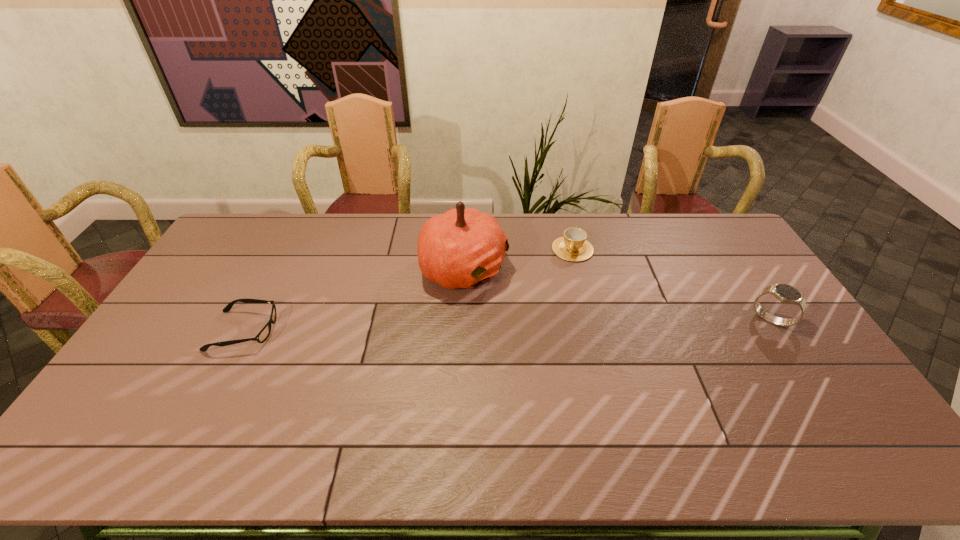
This screenshot has width=960, height=540. I want to click on vacant space on the desktop that is between the leftmost object and the rightmost object and is positioned on the front-facing side of the pumpkin, so click(583, 323).

Identify the location of free space on the desktop that is between the leftmost object and the third shortest object and is positioned with the handle on the side of the second object from right to left. (546, 325).